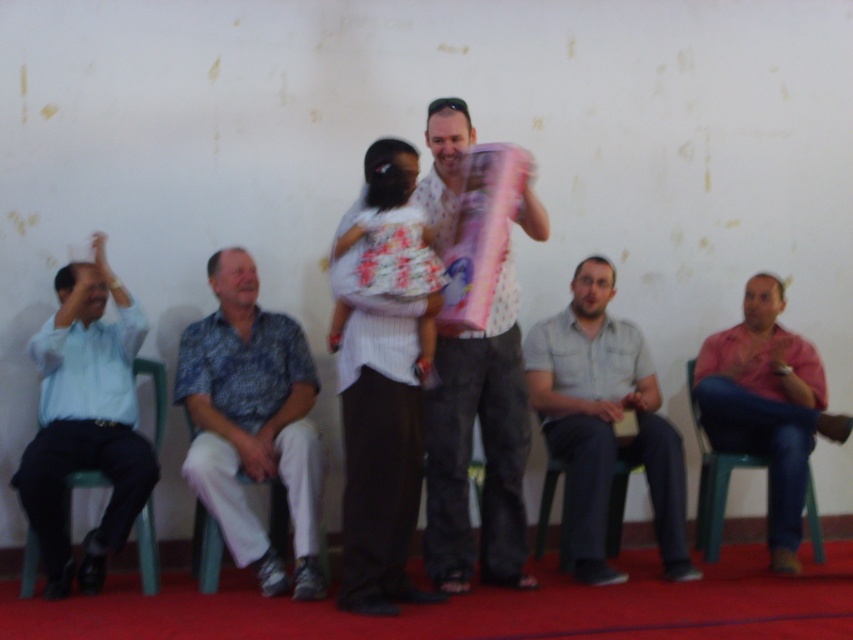
Between gray cotton shirt at center and green plastic chair at lower right, which one has less height?

green plastic chair at lower right

Does gray cotton shirt at center come in front of green plastic chair at lower right?

Yes, it is in front of green plastic chair at lower right.

I want to click on gray cotton shirt at center, so click(x=604, y=422).

Image resolution: width=853 pixels, height=640 pixels. What are the coordinates of `gray cotton shirt at center` in the screenshot? It's located at (604, 422).

Who is positioned more to the right, gray cotton shirt at center or green plastic chair at lower center?

gray cotton shirt at center

Who is taller, gray cotton shirt at center or green plastic chair at lower center?

gray cotton shirt at center

The image size is (853, 640). In order to click on gray cotton shirt at center in this screenshot , I will do `click(604, 422)`.

At what (x,y) coordinates should I click in order to perform the action: click on gray cotton shirt at center. Please return your answer as a coordinate pair (x, y). This screenshot has width=853, height=640. Looking at the image, I should click on (604, 422).

What do you see at coordinates (252, 422) in the screenshot?
I see `blue printed shirt at center` at bounding box center [252, 422].

Does point (184, 344) come in front of point (490, 556)?

No, (184, 344) is further to viewer.

Identify the location of blue printed shirt at center. (252, 422).